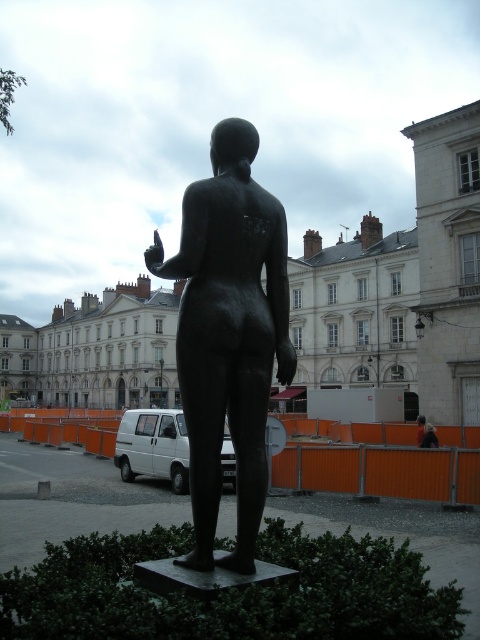
You are an art student observing the bronze statue at center and the blurred fabric woman at center in the image. Which object is wider?

The bronze statue at center is wider than the blurred fabric woman at center because the bronze statue at center has a greater width according to the description.

You are a photographer trying to capture both the bronze statue at center and the blurred fabric woman at center in the same frame. Given that your camera has a maximum focus range of 30 meters, will you be able to focus on both subjects simultaneously?

The bronze statue at center and blurred fabric woman at center are 38.41 meters apart, which exceeds the camera maximum focus range of 30 meters. Therefore, you cannot focus on both subjects simultaneously.

You are an art student observing the bronze statue at center and the blurred fabric woman at center in the image. Which of the two figures is taller?

The bronze statue at center is taller than the blurred fabric woman at center.